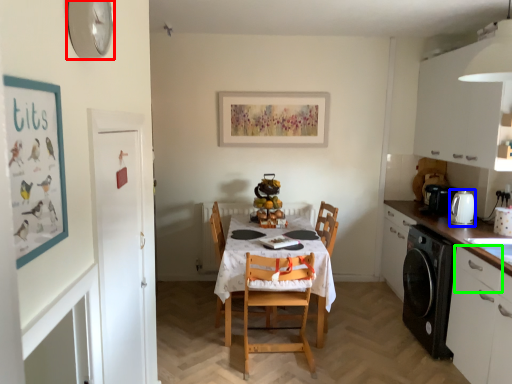
Question: Estimate the real-world distances between objects in this image. Which object is farther from clock (highlighted by a red box), appliance (highlighted by a blue box) or drawer (highlighted by a green box)?

Choices:
 (A) appliance
 (B) drawer

Answer: (A)